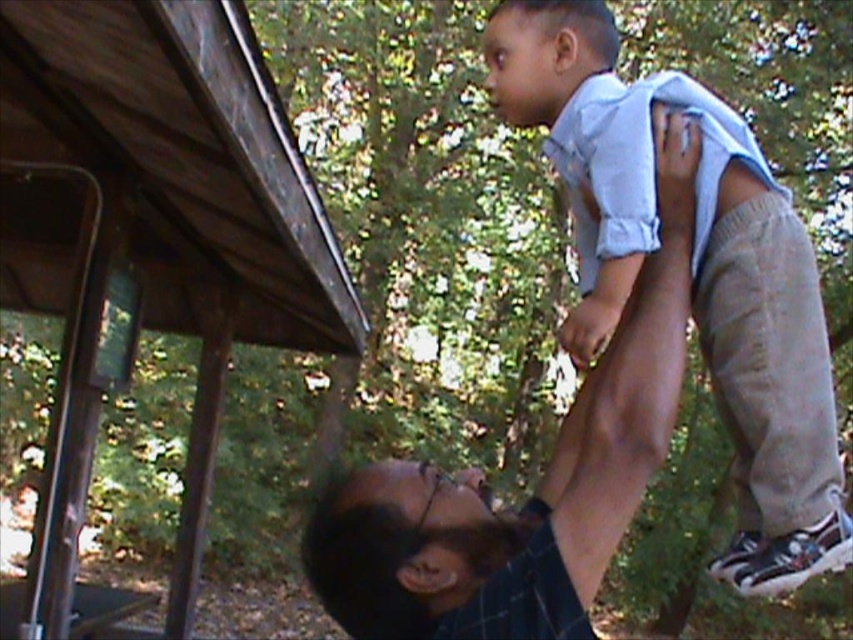
Question: Is light blue shirt at upper right further to camera compared to dark brown hair at upper center?

Choices:
 (A) yes
 (B) no

Answer: (A)

Question: Observing the image, what is the correct spatial positioning of light blue shirt at upper right in reference to dark brown hair at upper center?

Choices:
 (A) below
 (B) above

Answer: (B)

Question: Which point is closer to the camera taking this photo?

Choices:
 (A) (758, 483)
 (B) (473, 531)

Answer: (B)

Question: In this image, where is light blue shirt at upper right located relative to dark brown hair at upper center?

Choices:
 (A) right
 (B) left

Answer: (A)

Question: Which point appears closest to the camera in this image?

Choices:
 (A) (604, 51)
 (B) (352, 525)

Answer: (B)